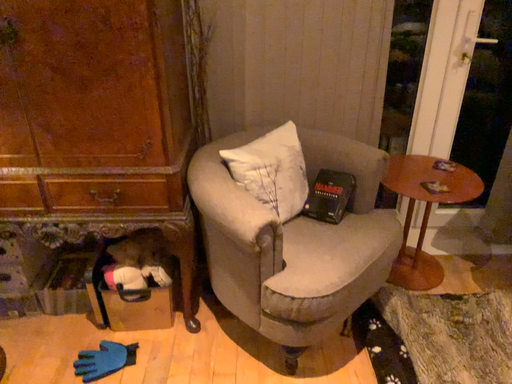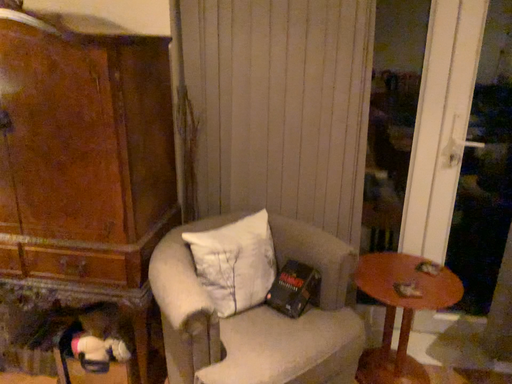
Question: Which way did the camera rotate in the video?

Choices:
 (A) rotated upward
 (B) rotated downward

Answer: (A)